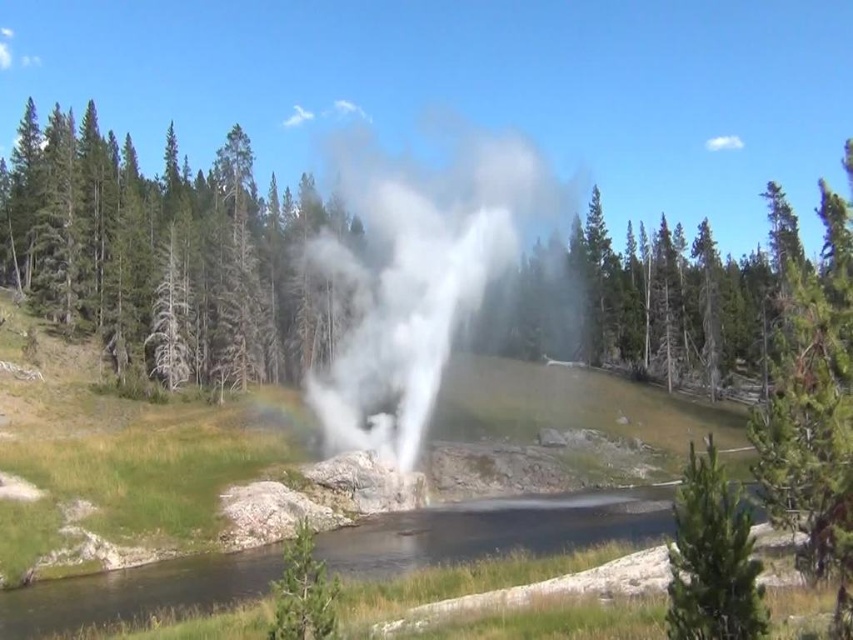
Does white vapor at center appear on the right side of green textured pine at lower right?

In fact, white vapor at center is to the left of green textured pine at lower right.

Locate an element on the screen. The image size is (853, 640). white vapor at center is located at coordinates (418, 276).